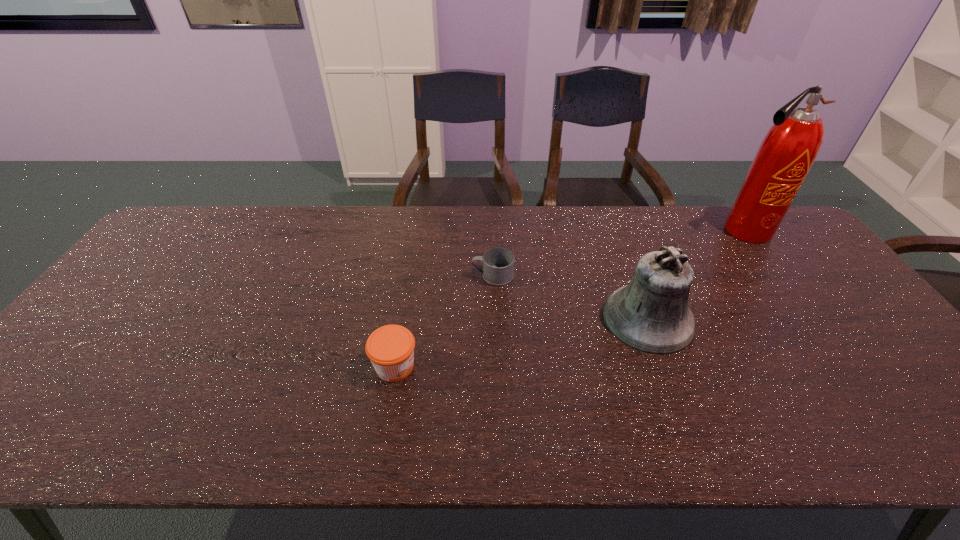
This screenshot has width=960, height=540. In the image, there is a desktop. Find the location of `vacant space at the far right corner`. vacant space at the far right corner is located at coordinates tap(782, 240).

Locate an element on the screen. free space that is in between the farthest object and the second object from left to right is located at coordinates (618, 253).

Identify the location of free spot between the leftmost object and the second object from right to left. (521, 342).

Where is `vacant area that lies between the leftmost object and the shortest object`? The image size is (960, 540). vacant area that lies between the leftmost object and the shortest object is located at coordinates (444, 321).

The width and height of the screenshot is (960, 540). I want to click on vacant space that's between the rightmost object and the third object from left to right, so pos(696,274).

At what (x,y) coordinates should I click in order to perform the action: click on free space between the fire extinguisher and the jam. Please return your answer as a coordinate pair (x, y). Image resolution: width=960 pixels, height=540 pixels. Looking at the image, I should click on (569, 298).

Find the location of `free spot between the fire extinguisher and the mug`. free spot between the fire extinguisher and the mug is located at coordinates (618, 253).

At what (x,y) coordinates should I click in order to perform the action: click on free area in between the third shortest object and the third nearest object. Please return your answer as a coordinate pair (x, y). Looking at the image, I should click on (570, 297).

Where is `vacant region between the shortest object and the third object from left to right`? The width and height of the screenshot is (960, 540). vacant region between the shortest object and the third object from left to right is located at coordinates (570, 297).

This screenshot has height=540, width=960. What are the coordinates of `vacant space in between the second object from right to left and the leftmost object` in the screenshot? It's located at (521, 342).